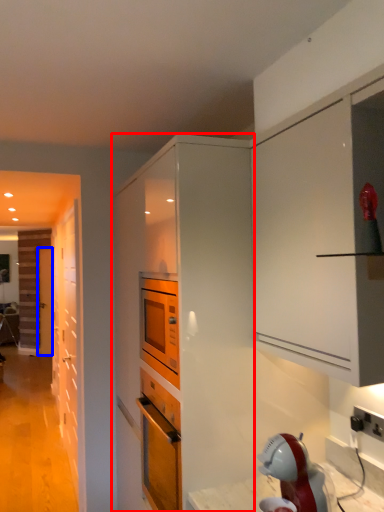
Question: Which of the following is the closest to the observer, cabinetry (highlighted by a red box) or door (highlighted by a blue box)?

Choices:
 (A) cabinetry
 (B) door

Answer: (A)